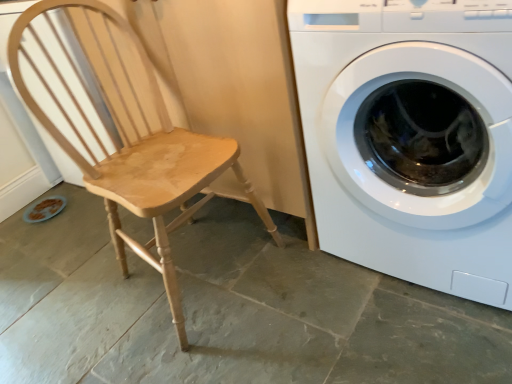
Where is `blank area to the left of light wood chair at left`? The width and height of the screenshot is (512, 384). blank area to the left of light wood chair at left is located at coordinates (71, 306).